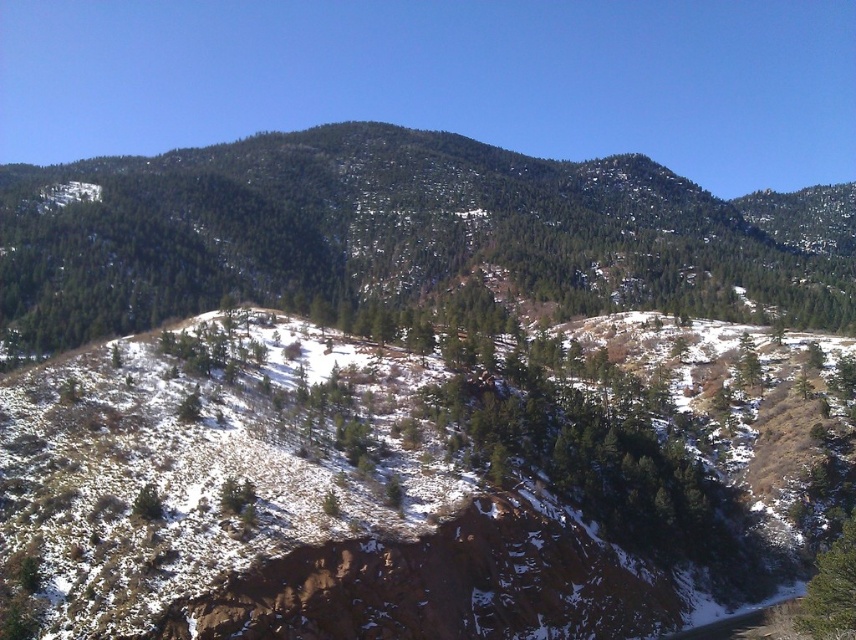
Question: Does green textured hillside at center have a greater width compared to green matte tree at lower right?

Choices:
 (A) no
 (B) yes

Answer: (B)

Question: Is green textured hillside at center smaller than green matte tree at lower right?

Choices:
 (A) no
 (B) yes

Answer: (A)

Question: Which point is farther from the camera taking this photo?

Choices:
 (A) (706, 228)
 (B) (835, 556)

Answer: (A)

Question: Does green textured hillside at center appear on the left side of green matte tree at lower right?

Choices:
 (A) yes
 (B) no

Answer: (B)